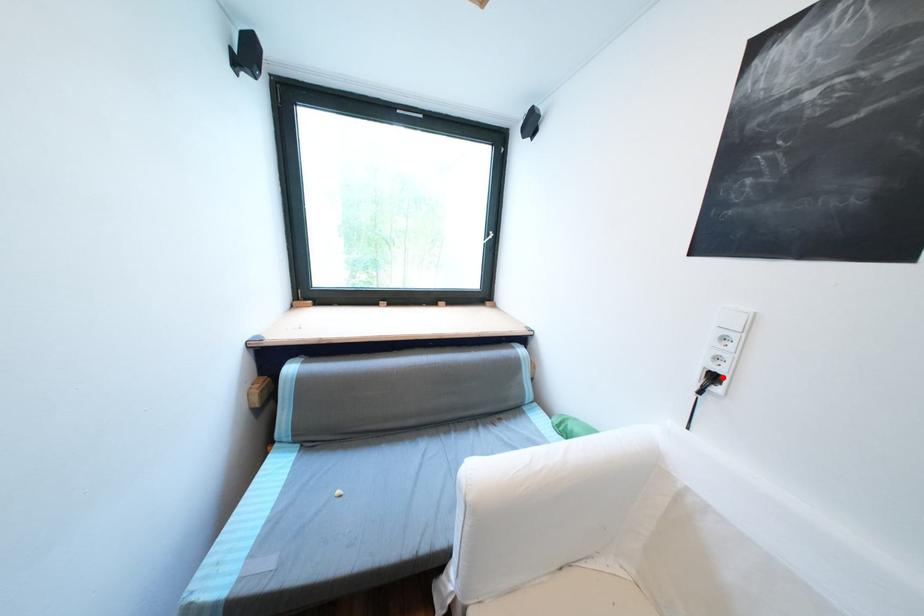
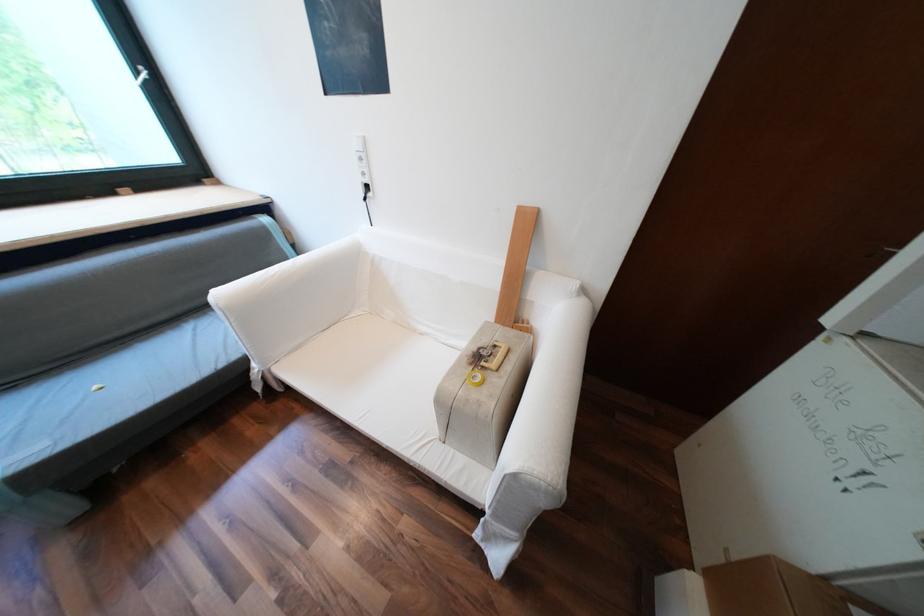
Find the pixel in the second image that matches the highlighted location in the first image.

(377, 187)